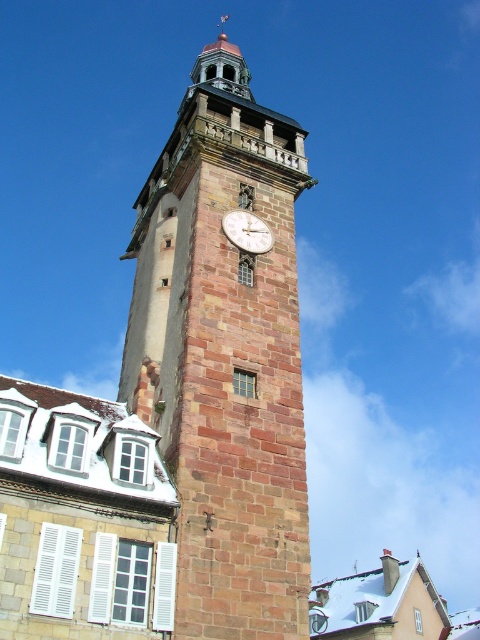
Is brown stone clock tower at center closer to camera compared to brick clock at center?

Yes, brown stone clock tower at center is in front of brick clock at center.

Is brown stone clock tower at center above brick clock at center?

Correct, brown stone clock tower at center is located above brick clock at center.

Locate an element on the screen. brown stone clock tower at center is located at coordinates (225, 355).